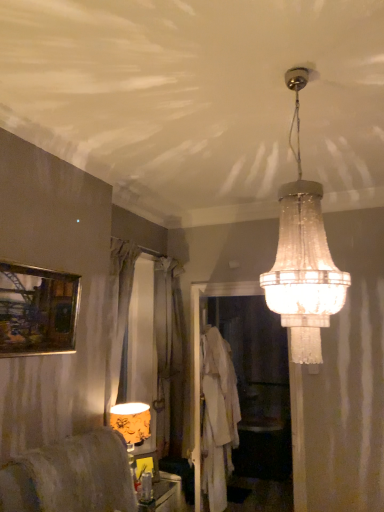
Question: From a real-world perspective, is yellow floral fabric lampshade at lower left, the 2th lamp viewed from the right, above or below clear glass chandelier at upper center, the 1th lamp in the right-to-left sequence?

Choices:
 (A) below
 (B) above

Answer: (A)

Question: Looking at their shapes, would you say yellow floral fabric lampshade at lower left, which appears as the second lamp when viewed from the top, is wider or thinner than clear glass chandelier at upper center, the 1th lamp when ordered from front to back?

Choices:
 (A) wide
 (B) thin

Answer: (B)

Question: Which object is the closest to the white fabric robe at center?

Choices:
 (A) silky gray curtain at center
 (B) yellow floral fabric lampshade at lower left, which ranks as the second lamp in front-to-back order
 (C) translucent glass bottle at lower center, which is counted as the first furniture, starting from the back
 (D) matte gray fabric chair at lower left, the second furniture viewed from the back
 (E) gold-framed painting at upper left

Answer: (C)

Question: Considering the real-world distances, which object is farthest from the white fabric robe at center?

Choices:
 (A) silky gray curtain at center
 (B) translucent glass bottle at lower center, acting as the 2th furniture starting from the top
 (C) matte gray fabric chair at lower left, arranged as the second furniture when ordered from the bottom
 (D) yellow floral fabric lampshade at lower left, which appears as the second lamp when viewed from the top
 (E) gold-framed painting at upper left

Answer: (E)